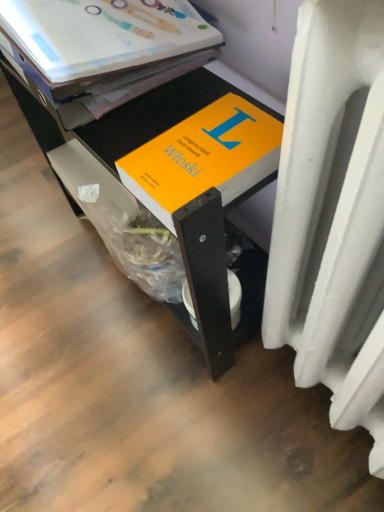
Question: Is orange matte book at center turned away from orange matte book at upper center?

Choices:
 (A) yes
 (B) no

Answer: (B)

Question: Is orange matte book at center thinner than orange matte book at upper center?

Choices:
 (A) yes
 (B) no

Answer: (A)

Question: Is orange matte book at center wider than orange matte book at upper center?

Choices:
 (A) yes
 (B) no

Answer: (B)

Question: Can you confirm if orange matte book at center is positioned to the left of orange matte book at upper center?

Choices:
 (A) no
 (B) yes

Answer: (A)

Question: Is orange matte book at center smaller than orange matte book at upper center?

Choices:
 (A) no
 (B) yes

Answer: (B)

Question: Does orange matte book at center contain orange matte book at upper center?

Choices:
 (A) yes
 (B) no

Answer: (B)

Question: Can you confirm if orange matte book at upper center is thinner than orange matte book at center?

Choices:
 (A) yes
 (B) no

Answer: (B)

Question: Does orange matte book at upper center appear on the left side of orange matte book at center?

Choices:
 (A) yes
 (B) no

Answer: (A)

Question: From the image's perspective, is orange matte book at upper center under orange matte book at center?

Choices:
 (A) yes
 (B) no

Answer: (B)

Question: Considering the relative sizes of orange matte book at upper center and orange matte book at center in the image provided, is orange matte book at upper center bigger than orange matte book at center?

Choices:
 (A) yes
 (B) no

Answer: (B)

Question: Does orange matte book at upper center come in front of orange matte book at center?

Choices:
 (A) no
 (B) yes

Answer: (B)

Question: Would you say orange matte book at upper center is a long distance from orange matte book at center?

Choices:
 (A) yes
 (B) no

Answer: (B)

Question: Could you tell me if orange matte book at center is facing orange matte book at upper center?

Choices:
 (A) no
 (B) yes

Answer: (A)